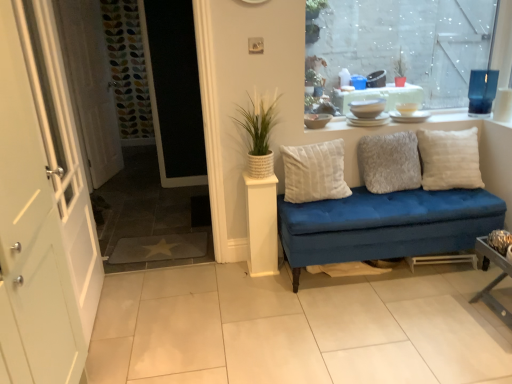
Locate an element on the screen. This screenshot has height=384, width=512. vacant space behind metallic silver table at lower right, which ranks as the 1th table in right-to-left order is located at coordinates (464, 281).